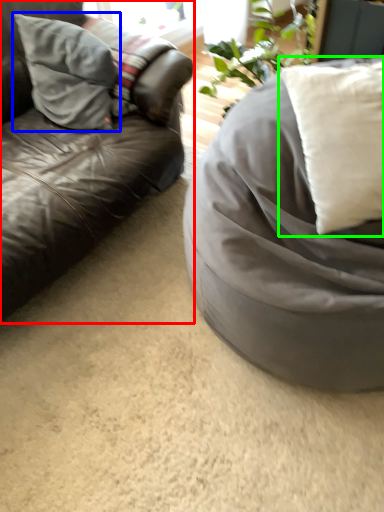
Question: Which object is positioned closest to studio couch (highlighted by a red box)? Select from pillow (highlighted by a blue box) and pillow (highlighted by a green box).

Choices:
 (A) pillow
 (B) pillow

Answer: (A)